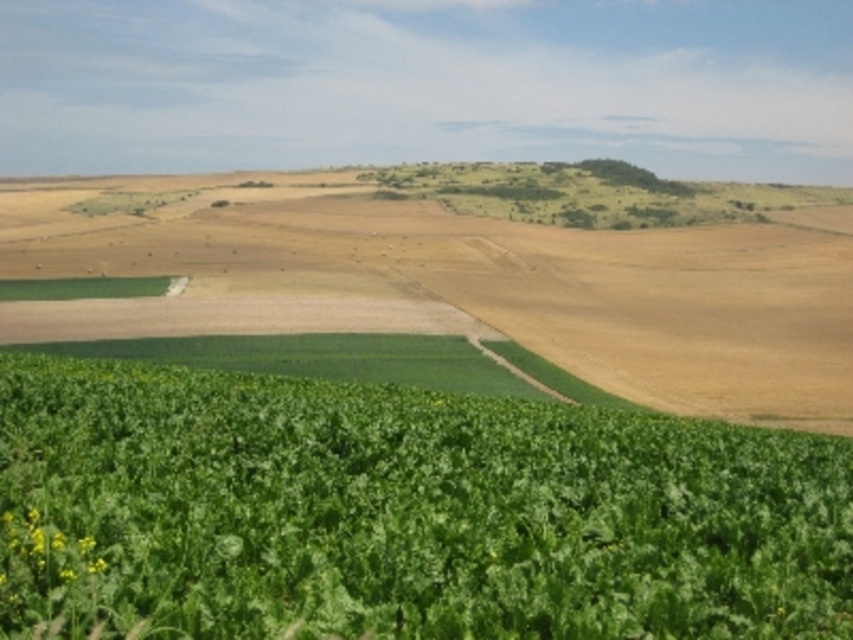
Is green leafy plant at lower left taller than green leafy field at lower center?

No, green leafy plant at lower left is not taller than green leafy field at lower center.

Is green leafy plant at lower left to the right of green leafy field at lower center from the viewer's perspective?

Correct, you'll find green leafy plant at lower left to the right of green leafy field at lower center.

Which is in front, point (62, 371) or point (480, 232)?

Positioned in front is point (62, 371).

This screenshot has height=640, width=853. I want to click on green leafy plant at lower left, so click(x=401, y=513).